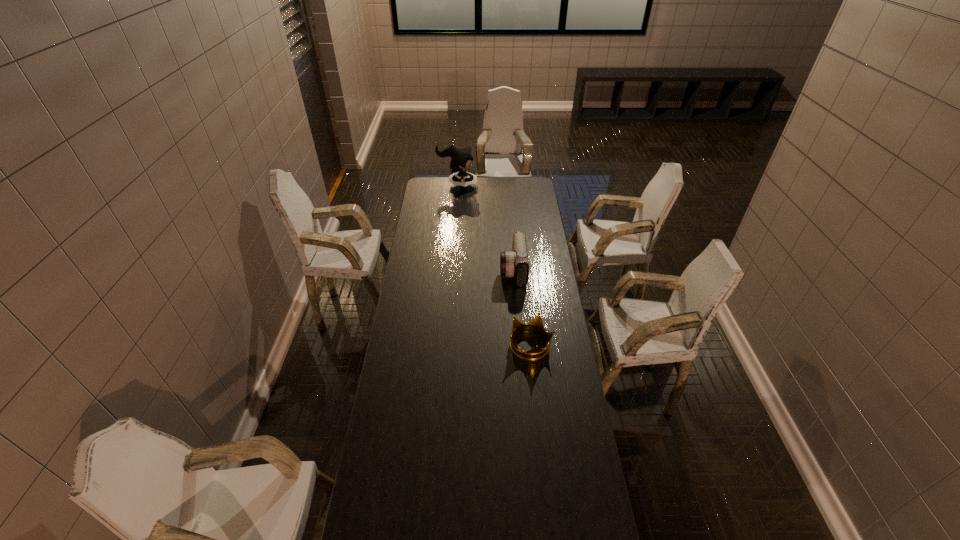
Find the location of a particular element. The image size is (960, 540). free space located 0.120m on the front of the nearest object is located at coordinates (536, 389).

Locate an element on the screen. object that is at the far edge is located at coordinates (461, 159).

The image size is (960, 540). Identify the location of object present at the left edge. (461, 159).

Locate an element on the screen. Image resolution: width=960 pixels, height=540 pixels. camcorder situated at the right edge is located at coordinates (514, 263).

At what (x,y) coordinates should I click in order to perform the action: click on crown that is at the right edge. Please return your answer as a coordinate pair (x, y). Image resolution: width=960 pixels, height=540 pixels. Looking at the image, I should click on (536, 324).

The width and height of the screenshot is (960, 540). Identify the location of object located in the far left corner section of the desktop. (461, 159).

Find the location of a particular element. free space at the far edge of the desktop is located at coordinates tap(505, 183).

At what (x,y) coordinates should I click in order to perform the action: click on vacant space at the left edge. Please return your answer as a coordinate pair (x, y). Looking at the image, I should click on (438, 200).

Find the location of a particular element. This screenshot has width=960, height=540. vacant point at the right edge is located at coordinates (544, 249).

In the image, there is a desktop. Find the location of `vacant space at the far left corner`. vacant space at the far left corner is located at coordinates (440, 197).